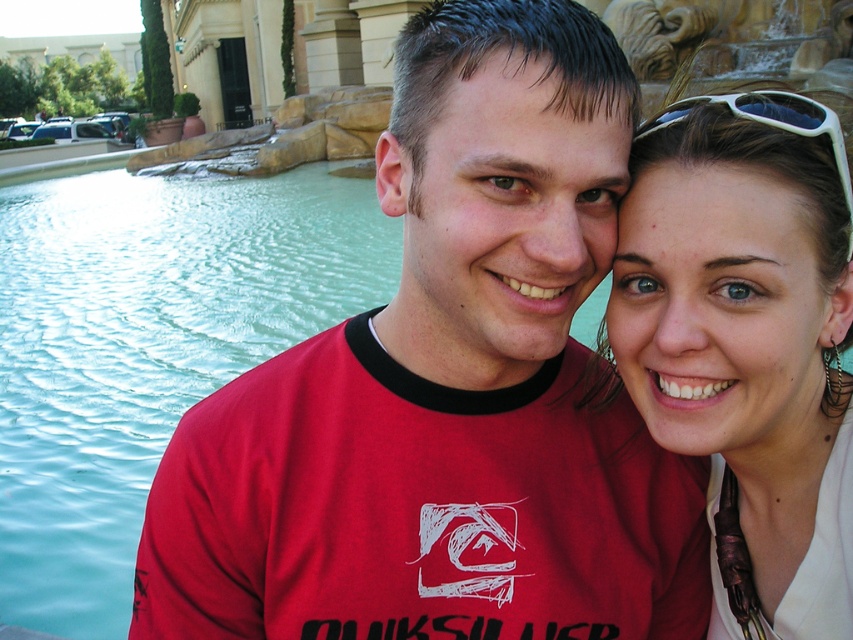
Who is positioned more to the left, clear blue water at center or white plastic sunglasses at upper right?

From the viewer's perspective, clear blue water at center appears more on the left side.

Who is lower down, clear blue water at center or white plastic sunglasses at upper right?

white plastic sunglasses at upper right

In order to click on clear blue water at center in this screenshot , I will do `click(146, 348)`.

You are a GUI agent. You are given a task and a screenshot of the screen. Output one action in this format:
    pyautogui.click(x=<x>, y=<y>)
    Task: Click on the clear blue water at center
    
    Given the screenshot: What is the action you would take?
    pyautogui.click(x=146, y=348)

Who is lower down, matte red t-shirt at center or clear blue water at center?

matte red t-shirt at center is lower down.

Between matte red t-shirt at center and clear blue water at center, which one appears on the left side from the viewer's perspective?

clear blue water at center

The height and width of the screenshot is (640, 853). I want to click on matte red t-shirt at center, so click(447, 390).

Is clear blue water at center positioned behind white matte sunglasses at upper right?

Yes, clear blue water at center is behind white matte sunglasses at upper right.

Does clear blue water at center have a smaller size compared to white matte sunglasses at upper right?

No.

Which is behind, point (6, 237) or point (669, 252)?

The point (6, 237) is more distant.

Image resolution: width=853 pixels, height=640 pixels. I want to click on clear blue water at center, so click(x=146, y=348).